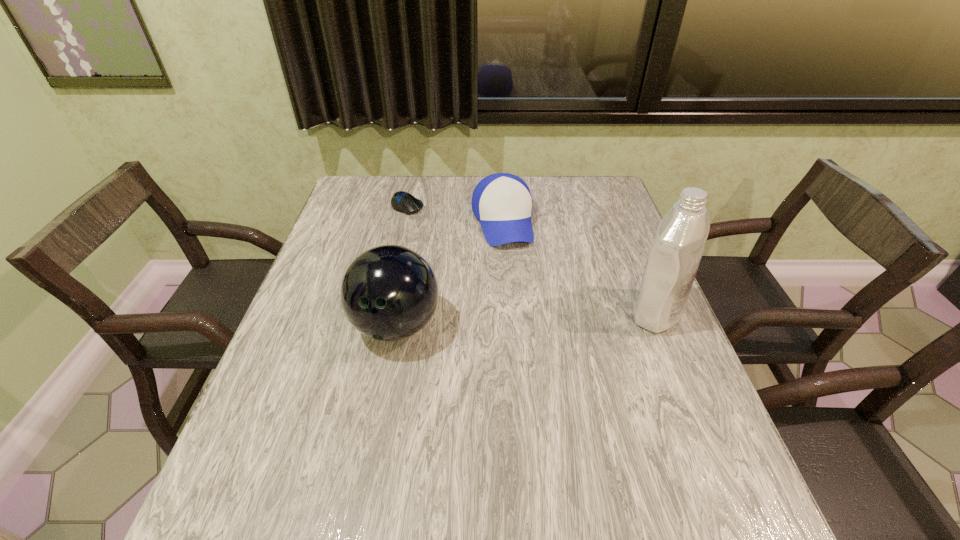
Identify the location of vacant space located on the front-facing side of the baseball cap. The image size is (960, 540). (520, 304).

Where is `free space located on the button side of the computer mouse`? The image size is (960, 540). free space located on the button side of the computer mouse is located at coordinates (467, 258).

The height and width of the screenshot is (540, 960). What are the coordinates of `blank space located 0.170m on the button side of the computer mouse` in the screenshot? It's located at (446, 240).

The image size is (960, 540). I want to click on free spot located 0.130m on the button side of the computer mouse, so click(439, 233).

Identify the location of baseball cap located in the far edge section of the desktop. (502, 202).

This screenshot has height=540, width=960. What are the coordinates of `computer mouse present at the far edge` in the screenshot? It's located at (404, 202).

The width and height of the screenshot is (960, 540). What are the coordinates of `bowling ball that is at the left edge` in the screenshot? It's located at (388, 293).

Identify the location of computer mouse that is at the left edge. (404, 202).

What are the coordinates of `object that is at the right edge` in the screenshot? It's located at (673, 261).

The image size is (960, 540). I want to click on object positioned at the far left corner, so click(x=404, y=202).